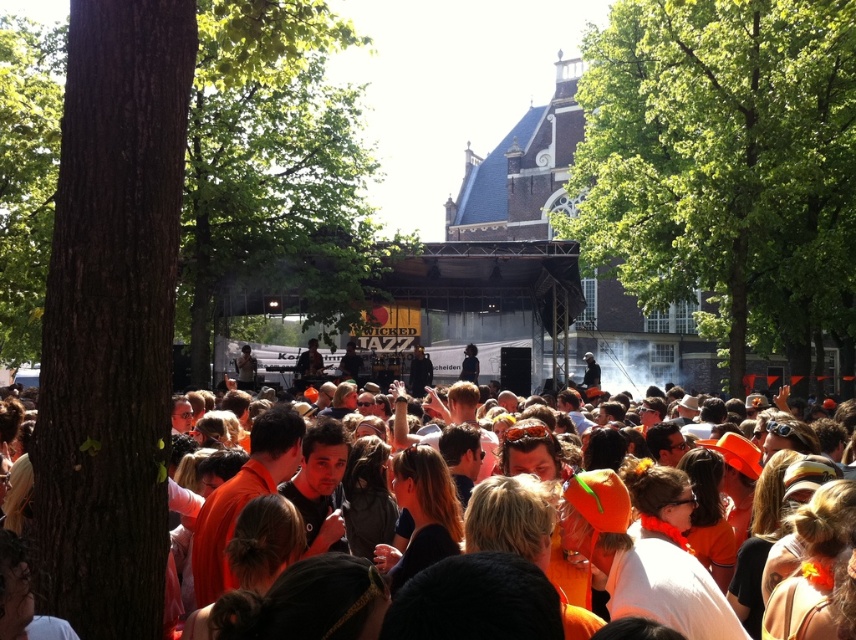
You are at the WICKED JAZZ event and want to find a spot where you can see both the brown rough bark tree at left and the green leafy tree at center clearly. Which direction should you move to ensure both are visible in your view?

To see both the brown rough bark tree at left and the green leafy tree at center clearly, move to the right side of the scene. Since the brown rough bark tree at left is positioned to the left of the green leafy tree at center, moving right will keep both trees within your field of view without obstruction.